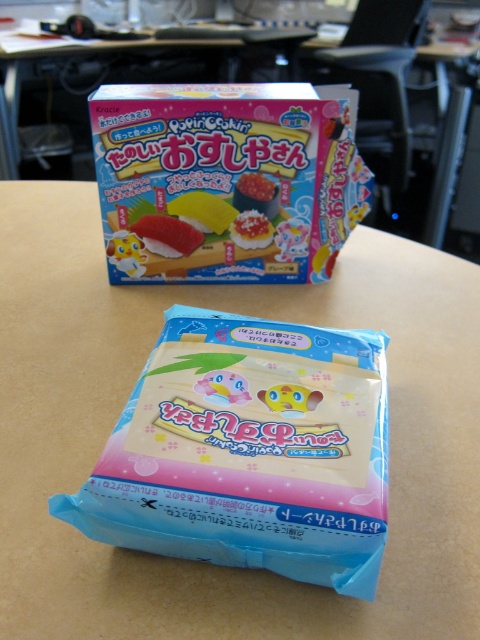
Question: Which point appears closest to the camera in this image?

Choices:
 (A) (214, 586)
 (B) (317, 401)

Answer: (A)

Question: Among these points, which one is farthest from the camera?

Choices:
 (A) (313, 408)
 (B) (228, 484)
 (C) (105, 417)

Answer: (C)

Question: Does blue matte plastic toy at center lie behind matte yellow plastic toy at center?

Choices:
 (A) no
 (B) yes

Answer: (A)

Question: Can you confirm if light brown wood at center is positioned below blue matte plastic toy at center?

Choices:
 (A) yes
 (B) no

Answer: (B)

Question: Which object is closer to the camera taking this photo?

Choices:
 (A) matte plastic toy at upper center
 (B) blue matte plastic toy at center
 (C) light brown wood at center
 (D) matte yellow plastic toy at center

Answer: (C)

Question: Does light brown wood at center lie in front of matte plastic toy at upper center?

Choices:
 (A) no
 (B) yes

Answer: (B)